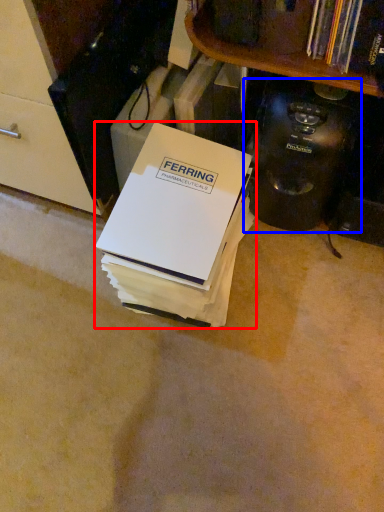
Question: Which point is further to the camera, box (highlighted by a red box) or appliance (highlighted by a blue box)?

Choices:
 (A) box
 (B) appliance

Answer: (B)